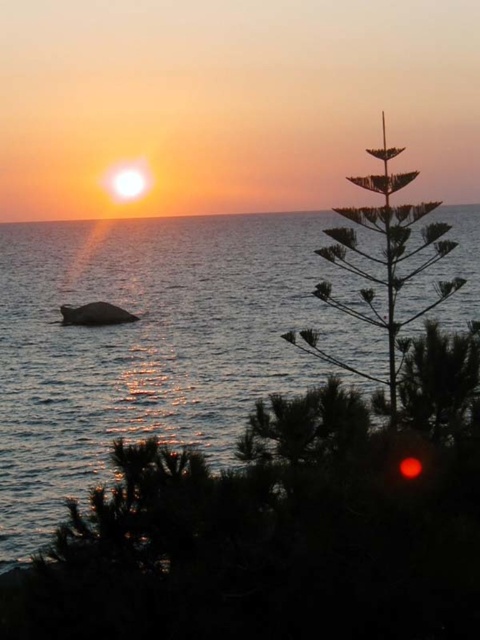
Can you confirm if silvery metallic tree at right is bigger than smooth ocean surface at center?

No, silvery metallic tree at right is not bigger than smooth ocean surface at center.

Which is in front, point (408, 257) or point (144, 211)?

Point (408, 257) is more forward.

Where is `silvery metallic tree at right`? The width and height of the screenshot is (480, 640). silvery metallic tree at right is located at coordinates (382, 262).

I want to click on silvery metallic tree at right, so click(x=382, y=262).

Who is positioned more to the right, glistening water at center or smooth ocean surface at center?

Positioned to the right is glistening water at center.

Does glistening water at center have a smaller size compared to smooth ocean surface at center?

Indeed, glistening water at center has a smaller size compared to smooth ocean surface at center.

Does point (243, 241) lie behind point (33, 216)?

No, (243, 241) is in front of (33, 216).

At what (x,y) coordinates should I click in order to perform the action: click on glistening water at center. Please return your answer as a coordinate pair (x, y). The width and height of the screenshot is (480, 640). Looking at the image, I should click on (153, 346).

Is glistening water at center to the left of silvery metallic tree at right from the viewer's perspective?

Indeed, glistening water at center is positioned on the left side of silvery metallic tree at right.

Is glistening water at center taller than silvery metallic tree at right?

Yes, glistening water at center is taller than silvery metallic tree at right.

Describe the element at coordinates (153, 346) in the screenshot. Image resolution: width=480 pixels, height=640 pixels. I see `glistening water at center` at that location.

Find the location of a particular element. The image size is (480, 640). glistening water at center is located at coordinates (153, 346).